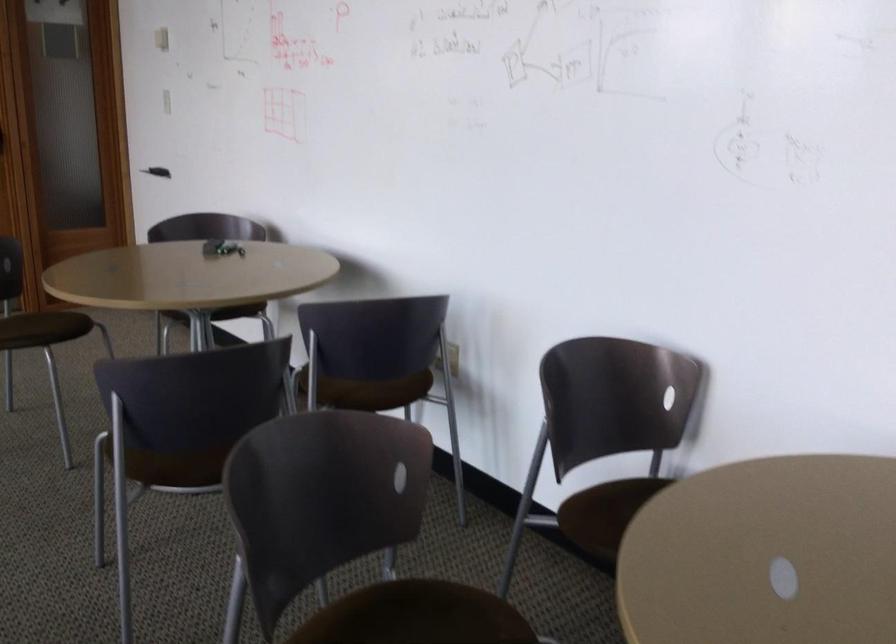
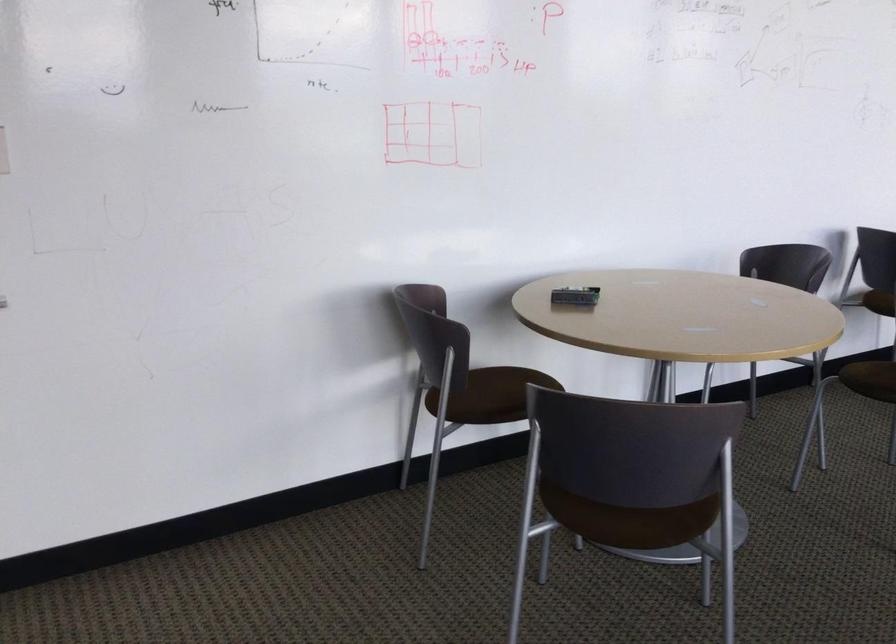
Question: I am providing you with two images of the same scene from different viewpoints. Please identify which objects are invisible in image2.

Choices:
 (A) whiteboard eraser
 (B) penguin stuffed toy
 (C) chair sitting surface
 (D) white light switch

Answer: (D)